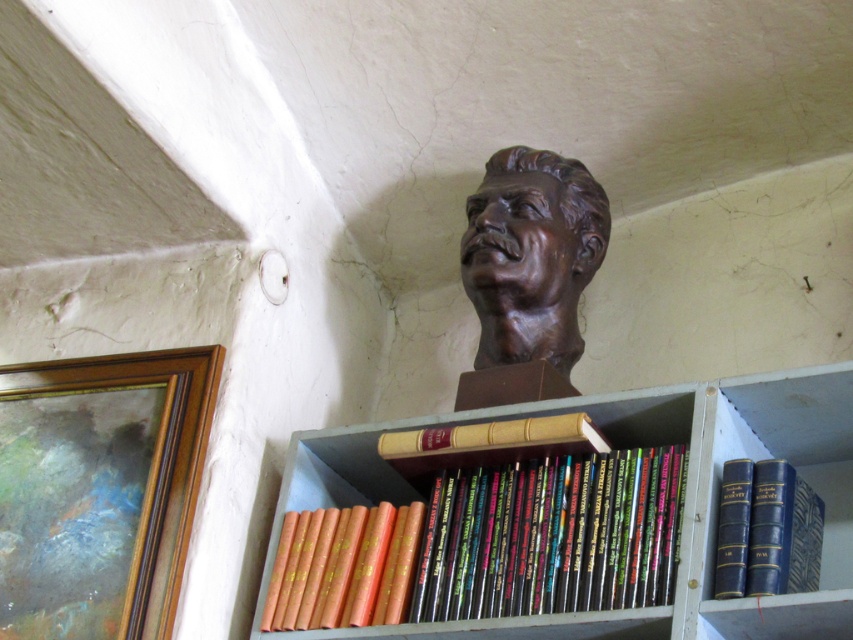
Is wooden bookshelf at upper center closer to the viewer compared to blue leather-bound book at upper right?

Yes, wooden bookshelf at upper center is closer to the viewer.

Measure the distance between wooden bookshelf at upper center and camera.

wooden bookshelf at upper center and camera are 6.45 feet apart.

In order to click on wooden bookshelf at upper center in this screenshot , I will do `click(572, 513)`.

Where is `hardcover books at center`? This screenshot has width=853, height=640. hardcover books at center is located at coordinates (552, 536).

You are a GUI agent. You are given a task and a screenshot of the screen. Output one action in this format:
    pyautogui.click(x=<x>, y=<y>)
    Task: Click on the hardcover books at center
    The image size is (853, 640).
    Given the screenshot: What is the action you would take?
    pyautogui.click(x=552, y=536)

Between hardcover books at center and orange matte book at center, which one appears on the right side from the viewer's perspective?

Positioned to the right is hardcover books at center.

Who is more distant from viewer, (553, 604) or (289, 605)?

Point (289, 605)

Where is `hardcover books at center`? This screenshot has height=640, width=853. hardcover books at center is located at coordinates (552, 536).

Where is `hardcover books at center`? The image size is (853, 640). hardcover books at center is located at coordinates (552, 536).